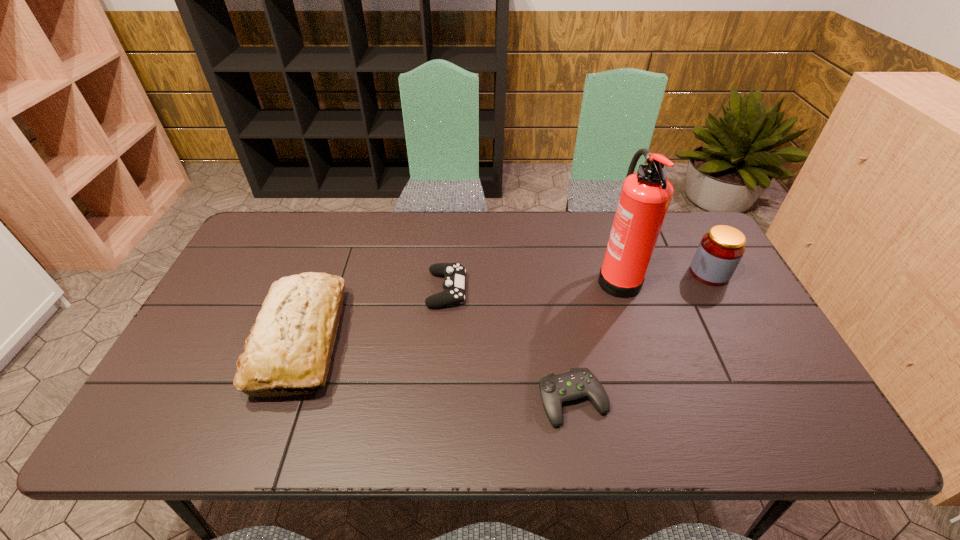
At what (x,y) coordinates should I click in order to perform the action: click on vacant space at the left edge of the desktop. Please return your answer as a coordinate pair (x, y). This screenshot has height=540, width=960. Looking at the image, I should click on (201, 354).

Locate an element on the screen. vacant space at the right edge of the desktop is located at coordinates (x=729, y=306).

You are a GUI agent. You are given a task and a screenshot of the screen. Output one action in this format:
    pyautogui.click(x=<x>, y=<y>)
    Task: Click on the free space at the far left corner of the desktop
    The height and width of the screenshot is (540, 960).
    Given the screenshot: What is the action you would take?
    pyautogui.click(x=255, y=255)

I want to click on free space at the near left corner, so click(188, 448).

Where is `free space at the far right corner of the desktop`? Image resolution: width=960 pixels, height=540 pixels. free space at the far right corner of the desktop is located at coordinates (698, 241).

This screenshot has width=960, height=540. I want to click on vacant area at the near right corner of the desktop, so click(x=801, y=433).

Identify the location of vacant area that lies between the taller control and the leftmost object. The image size is (960, 540). (374, 315).

Image resolution: width=960 pixels, height=540 pixels. Find the location of `unoccupied area between the rightmost object and the fourth object from left to right`. unoccupied area between the rightmost object and the fourth object from left to right is located at coordinates (663, 274).

Locate an element on the screen. The width and height of the screenshot is (960, 540). free spot between the fourth object from left to right and the leftmost object is located at coordinates (459, 308).

Locate an element on the screen. This screenshot has width=960, height=540. vacant space that's between the leftmost object and the fire extinguisher is located at coordinates (459, 308).